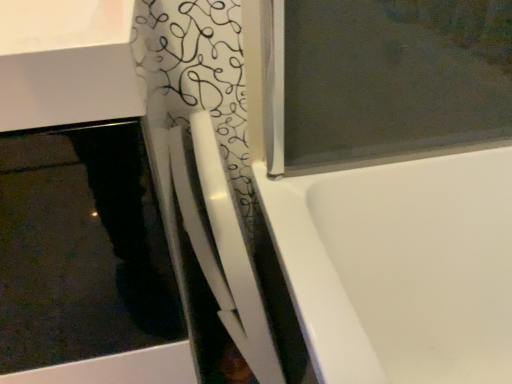
Image resolution: width=512 pixels, height=384 pixels. What do you see at coordinates (222, 245) in the screenshot?
I see `white glossy shower door at center` at bounding box center [222, 245].

You are a GUI agent. You are given a task and a screenshot of the screen. Output one action in this format:
    pyautogui.click(x=<x>, y=<y>)
    Task: Click on the white glossy shower door at center
    
    Given the screenshot: What is the action you would take?
    pyautogui.click(x=222, y=245)

Measure the distance between point (98, 50) and camera.

29.70 centimeters.

This screenshot has width=512, height=384. Describe the element at coordinates (80, 206) in the screenshot. I see `white glossy sink at upper left` at that location.

I want to click on white glossy sink at upper left, so click(x=80, y=206).

This screenshot has width=512, height=384. I want to click on white glossy shower door at center, so click(x=222, y=245).

In the image, is white glossy sink at upper left on the left side or the right side of white glossy shower door at center?

Based on their positions, white glossy sink at upper left is located to the left of white glossy shower door at center.

Relative to white glossy shower door at center, is white glossy sink at upper left in front or behind?

Visually, white glossy sink at upper left is located in front of white glossy shower door at center.

Is point (139, 196) closer to viewer compared to point (258, 317)?

Yes, point (139, 196) is in front of point (258, 317).

From the image's perspective, is white glossy sink at upper left above or below white glossy shower door at center?

Clearly, from the image's perspective, white glossy sink at upper left is below white glossy shower door at center.

From a real-world perspective, is white glossy sink at upper left over white glossy shower door at center?

Actually, white glossy sink at upper left is physically below white glossy shower door at center in the real world.

Considering the sizes of white glossy sink at upper left and white glossy shower door at center in the image, is white glossy sink at upper left wider or thinner than white glossy shower door at center?

white glossy sink at upper left is wider than white glossy shower door at center.

Considering the sizes of objects white glossy sink at upper left and white glossy shower door at center in the image provided, who is taller, white glossy sink at upper left or white glossy shower door at center?

white glossy sink at upper left.

Is white glossy sink at upper left bigger or smaller than white glossy shower door at center?

white glossy sink at upper left is bigger than white glossy shower door at center.

Choose the correct answer: Is white glossy sink at upper left inside white glossy shower door at center or outside it?

The correct answer is: outside.

Is white glossy sink at upper left not near white glossy shower door at center?

white glossy sink at upper left is actually quite close to white glossy shower door at center.

Is white glossy shower door at center at the back of white glossy sink at upper left?

No.

The image size is (512, 384). In order to click on sink below the white glossy shower door at center (from the image's perspective) in this screenshot , I will do `click(80, 206)`.

Considering the positions of objects white glossy shower door at center and white glossy sink at upper left in the image provided, who is more to the left, white glossy shower door at center or white glossy sink at upper left?

white glossy sink at upper left.

Which object is more forward, white glossy shower door at center or white glossy sink at upper left?

white glossy sink at upper left is more forward.

Does point (256, 352) come behind point (74, 123)?

Yes, point (256, 352) is behind point (74, 123).

From the image's perspective, is white glossy shower door at center above white glossy sink at upper left?

Indeed, from the image's perspective, white glossy shower door at center is shown above white glossy sink at upper left.

From a real-world perspective, which is physically above, white glossy shower door at center or white glossy sink at upper left?

white glossy shower door at center, from a real-world perspective.

Which of these two, white glossy shower door at center or white glossy sink at upper left, is wider?

white glossy sink at upper left.

Who is shorter, white glossy shower door at center or white glossy sink at upper left?

With less height is white glossy shower door at center.

Does white glossy shower door at center have a larger size compared to white glossy sink at upper left?

No.

In the scene shown: Choose the correct answer: Is white glossy shower door at center inside white glossy sink at upper left or outside it?

white glossy shower door at center is outside white glossy sink at upper left.

Are white glossy shower door at center and white glossy sink at upper left making contact?

No, white glossy shower door at center is not in contact with white glossy sink at upper left.

Consider the image. Is white glossy shower door at center aimed at white glossy sink at upper left?

No, white glossy shower door at center is not oriented towards white glossy sink at upper left.

How far apart are white glossy shower door at center and white glossy sink at upper left?

white glossy shower door at center and white glossy sink at upper left are 17.58 centimeters apart from each other.

In the image, there is a white glossy sink at upper left. Where is `shower door above it (from the image's perspective)`? shower door above it (from the image's perspective) is located at coordinates (222, 245).

You are a GUI agent. You are given a task and a screenshot of the screen. Output one action in this format:
    pyautogui.click(x=<x>, y=<y>)
    Task: Click on the sink in front of the white glossy shower door at center
    The image size is (512, 384).
    Given the screenshot: What is the action you would take?
    pyautogui.click(x=80, y=206)

Locate an element on the screen. The width and height of the screenshot is (512, 384). shower door behind the white glossy sink at upper left is located at coordinates (222, 245).